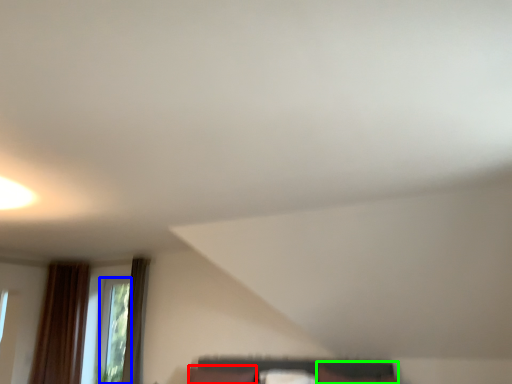
Question: Which object is the closest to the pillow (highlighted by a red box)? Choose among these: window (highlighted by a blue box) or furniture (highlighted by a green box).

Choices:
 (A) window
 (B) furniture

Answer: (B)